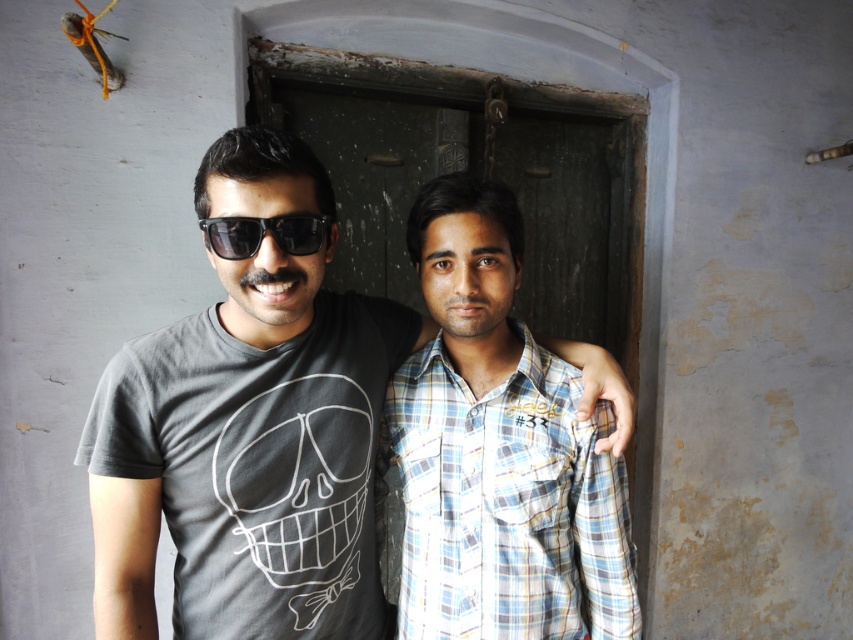
Please provide the 2D coordinates of the plaid shirt at center in the image. The coordinates should be in the format of a point with two decimal places, like this example format. Please do not add any extra text or explanation, just the coordinates in the format of a point. The image has a coordinate system where the origin is at the bottom left corner, and the x and y axes increase to the right and up respectively. The coordinates are normalized between 0 and 1. The question must mention the coordinate syt

The 2D coordinates of the plaid shirt at center are at point (498, 449).